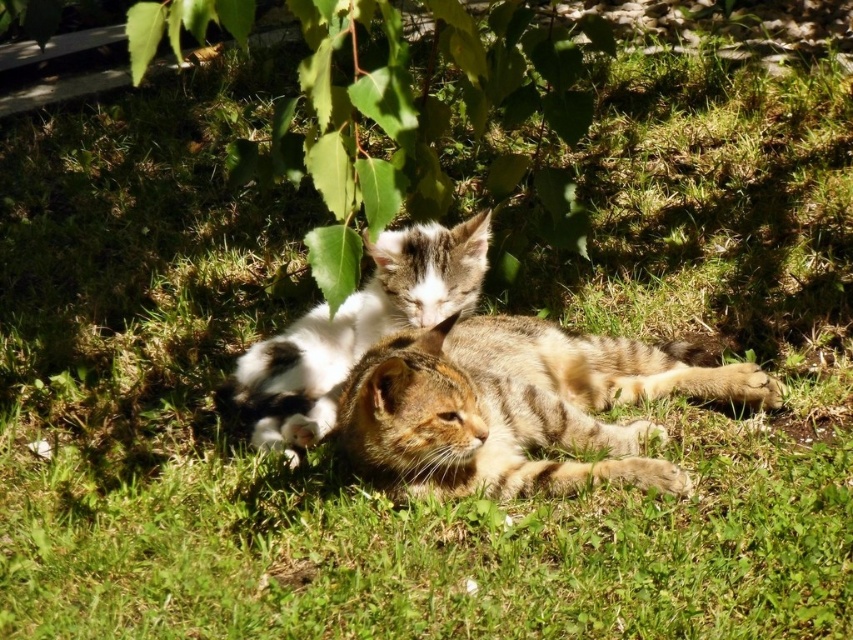
Question: Does tabby fur cat at center come behind white fur cat at center?

Choices:
 (A) yes
 (B) no

Answer: (B)

Question: Is the position of tabby fur cat at center less distant than that of white fur cat at center?

Choices:
 (A) yes
 (B) no

Answer: (A)

Question: Which object appears closest to the camera in this image?

Choices:
 (A) tabby fur cat at center
 (B) white fur cat at center

Answer: (A)

Question: Is the position of tabby fur cat at center more distant than that of white fur cat at center?

Choices:
 (A) no
 (B) yes

Answer: (A)